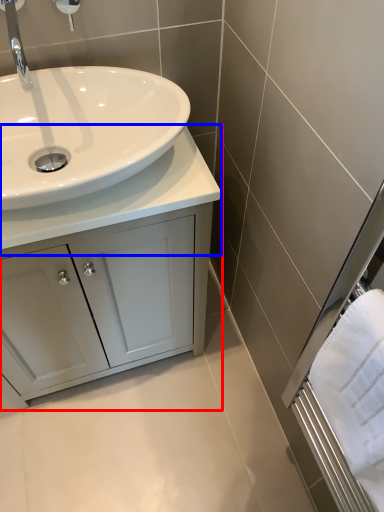
Question: Which object appears farthest to the camera in this image, bathroom cabinet (highlighted by a red box) or counter top (highlighted by a blue box)?

Choices:
 (A) bathroom cabinet
 (B) counter top

Answer: (A)